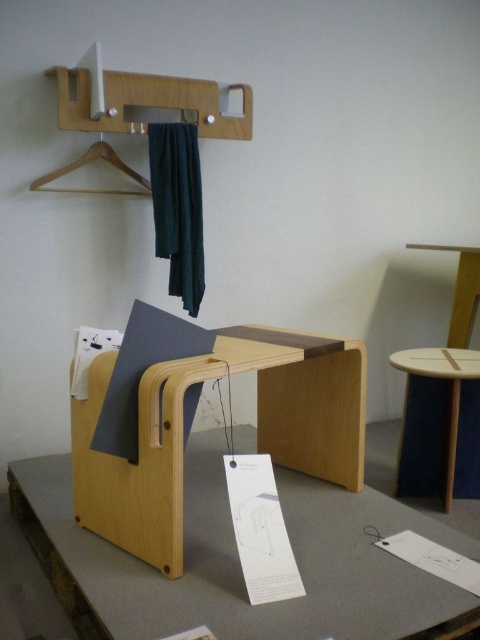
Question: Which point is closer to the camera taking this photo?

Choices:
 (A) (179, 154)
 (B) (107, 157)
 (C) (478, 387)

Answer: (C)

Question: Is light wood/wooden table at center closer to camera compared to light wood/finished table at center?

Choices:
 (A) yes
 (B) no

Answer: (A)

Question: Does matte wood table at center have a smaller size compared to dark green fabric at center?

Choices:
 (A) no
 (B) yes

Answer: (A)

Question: Which object is the farthest from the dark green fabric at center?

Choices:
 (A) wooden hanger at upper left
 (B) light wood/wooden table at center

Answer: (B)

Question: In this image, where is light wood/wooden table at center located relative to matte wood table at center?

Choices:
 (A) left
 (B) right

Answer: (A)

Question: Which object is the farthest from the light wood/wooden table at center?

Choices:
 (A) light wood/finished table at center
 (B) dark green fabric at center
 (C) matte wood table at center

Answer: (B)